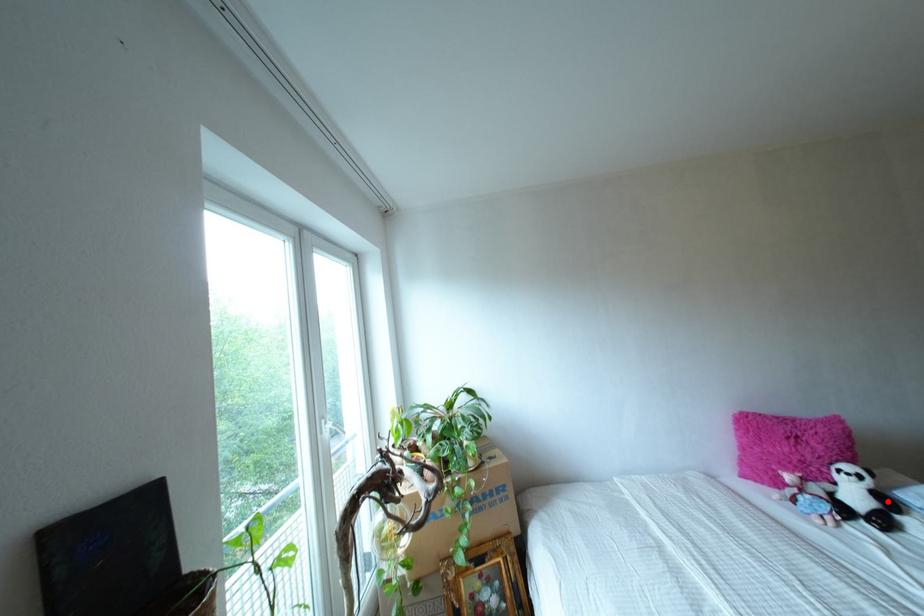
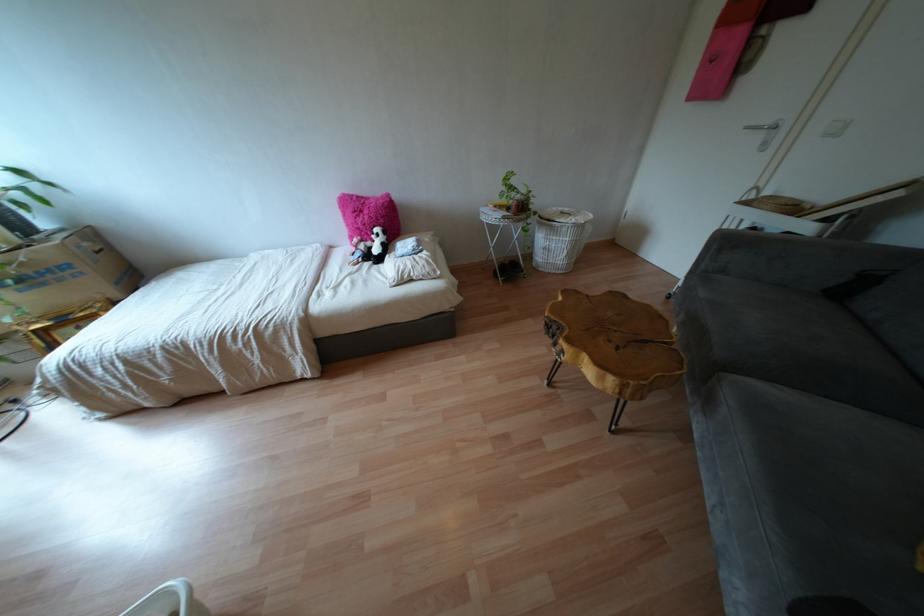
The point at the highlighted location is marked in the first image. Where is the corresponding point in the second image?

(385, 248)